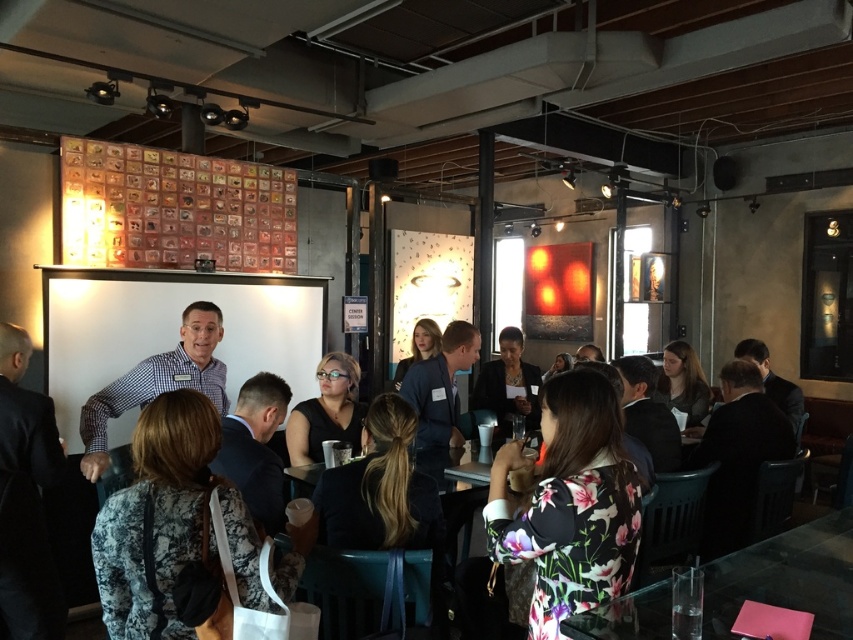
You are standing at the entrance of the venue and want to locate the person wearing the checkered shirt at center. According to the coordinates provided, where should you look relative to the entrance?

The checkered shirt at center is located at coordinates point (x=157, y=381), which would be to the right and slightly below the center point of the image from the entrance perspective.